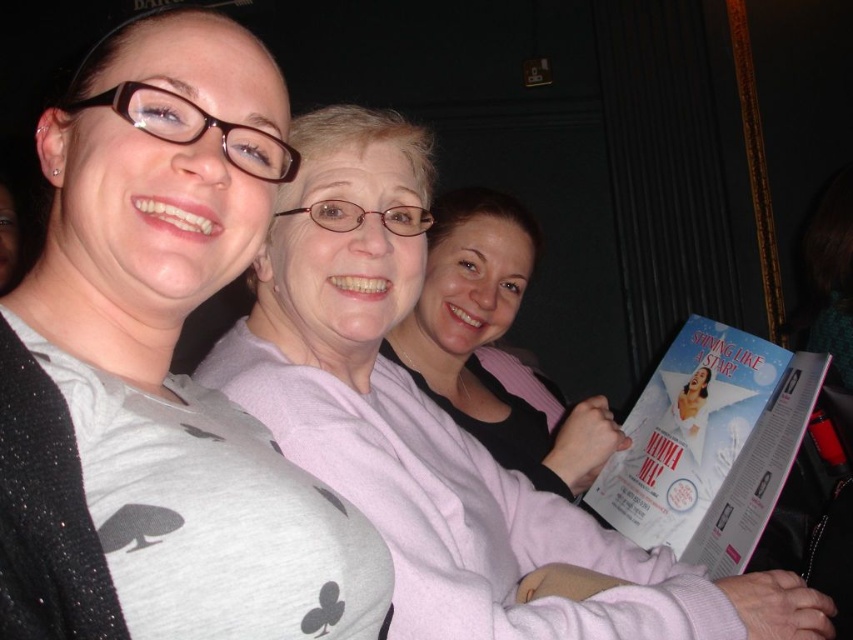
Image resolution: width=853 pixels, height=640 pixels. I want to click on gray matte shirt at upper left, so click(x=160, y=371).

Which is in front, point (59, 557) or point (418, 314)?

Point (59, 557) is in front.

Identify the location of gray matte shirt at upper left. Image resolution: width=853 pixels, height=640 pixels. (160, 371).

Between point (157, 490) and point (634, 504), which one is positioned behind?

Positioned behind is point (634, 504).

Locate an element on the screen. Image resolution: width=853 pixels, height=640 pixels. gray matte shirt at upper left is located at coordinates (160, 371).

Can you confirm if gray matte sweater at center is taller than pink fabric sweater at center?

Yes.

Does gray matte sweater at center have a greater width compared to pink fabric sweater at center?

Correct, the width of gray matte sweater at center exceeds that of pink fabric sweater at center.

Which is behind, point (442, 596) or point (424, 291)?

The point (424, 291) is more distant.

Identify the location of gray matte sweater at center. The image size is (853, 640). (436, 422).